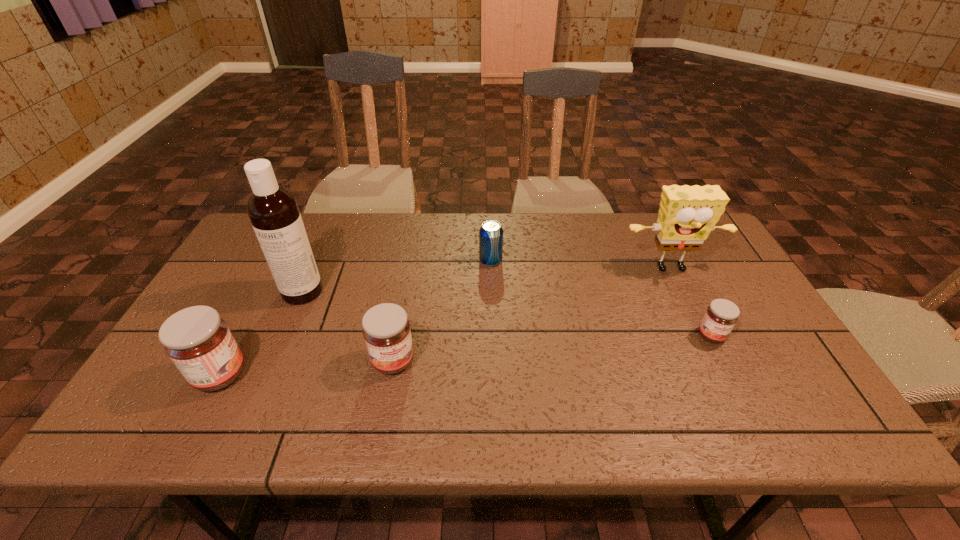
Find the location of a particular element. The width and height of the screenshot is (960, 540). the leftmost jam is located at coordinates (198, 341).

You are a GUI agent. You are given a task and a screenshot of the screen. Output one action in this format:
    pyautogui.click(x=<x>, y=<y>)
    Task: Click on the third object from left to right
    The image size is (960, 540).
    Given the screenshot: What is the action you would take?
    pyautogui.click(x=386, y=330)

Where is `the second jam from left to right`? the second jam from left to right is located at coordinates (386, 330).

Where is `the shortest object`? Image resolution: width=960 pixels, height=540 pixels. the shortest object is located at coordinates (721, 315).

The width and height of the screenshot is (960, 540). Identify the location of the rightmost jam. point(721,315).

Identify the location of beer can. This screenshot has height=540, width=960. (491, 233).

Where is `the fifth shortest object`? The height and width of the screenshot is (540, 960). the fifth shortest object is located at coordinates (687, 214).

The image size is (960, 540). I want to click on dishwasher detergent, so click(x=273, y=211).

Find the location of a particular element. The image size is (960, 540). vacant space located 0.090m on the left of the leftmost jam is located at coordinates (156, 375).

Locate an element on the screen. Image resolution: width=960 pixels, height=540 pixels. free space located 0.120m on the back of the second tallest jam is located at coordinates (402, 309).